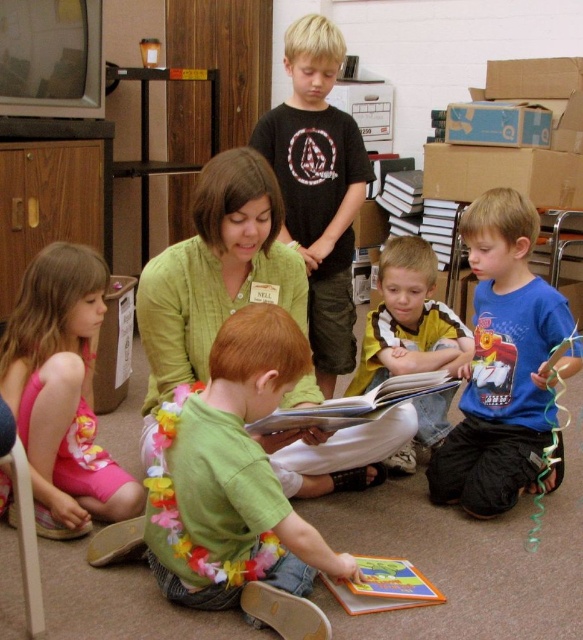
Between point (290, 561) and point (50, 428), which one is positioned in front?

Positioned in front is point (290, 561).

Is green fabric shirt at center positioned in front of pink fabric dress at lower left?

Yes.

Does point (255, 321) come in front of point (1, 353)?

Yes.

At what (x,y) coordinates should I click in order to perform the action: click on green fabric shirt at center. Please return your answer as a coordinate pair (x, y). Looking at the image, I should click on (233, 476).

Is point (247, 346) closer to viewer compared to point (324, 428)?

That is True.

Looking at this image, who is lower down, green fabric shirt at center or hardcover book at center?

green fabric shirt at center is lower down.

What do you see at coordinates (233, 476) in the screenshot? The width and height of the screenshot is (583, 640). I see `green fabric shirt at center` at bounding box center [233, 476].

This screenshot has width=583, height=640. Identify the location of green fabric shirt at center. (233, 476).

Can you confirm if green fabric shirt at center is thinner than green knitted sweater at center?

No.

I want to click on green fabric shirt at center, so click(x=233, y=476).

Which is behind, point (191, 508) or point (338, 136)?

Point (338, 136)

The image size is (583, 640). I want to click on green fabric shirt at center, so click(233, 476).